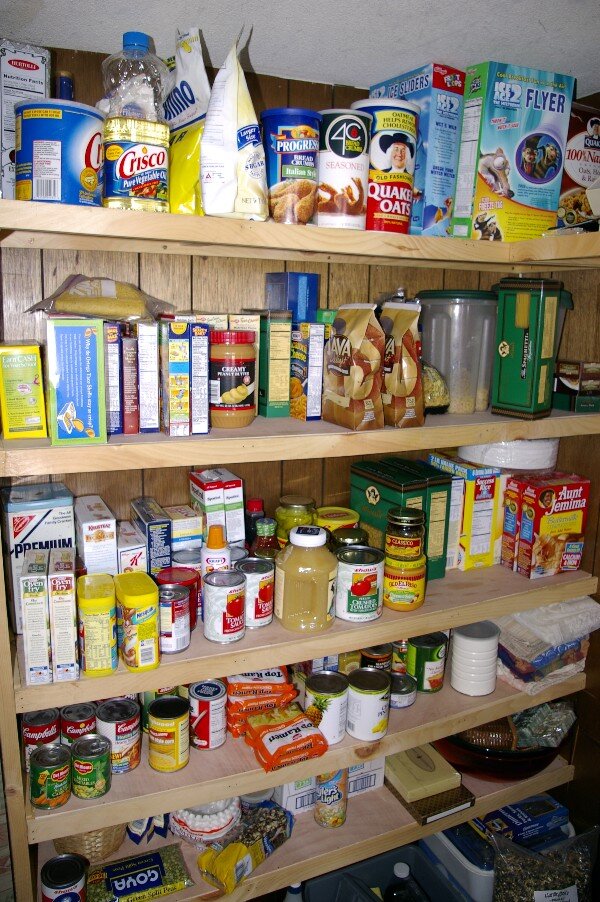
The image size is (600, 902). I want to click on items on the floor, so click(548, 870), click(521, 827), click(481, 857), click(479, 879), click(404, 878), click(299, 888).